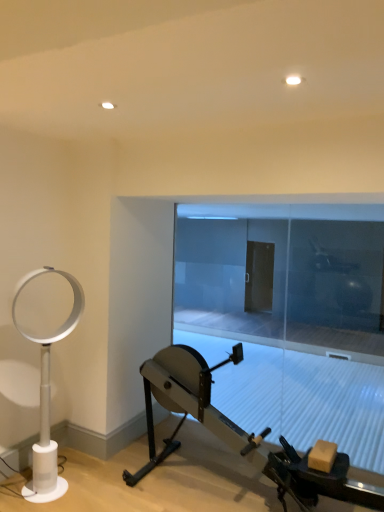
Question: Is transparent glass door at center further to camera compared to metallic silver stationary bicycle at center?

Choices:
 (A) yes
 (B) no

Answer: (A)

Question: From a real-world perspective, is transparent glass door at center below metallic silver stationary bicycle at center?

Choices:
 (A) yes
 (B) no

Answer: (B)

Question: Does transparent glass door at center appear on the right side of metallic silver stationary bicycle at center?

Choices:
 (A) no
 (B) yes

Answer: (B)

Question: Does transparent glass door at center have a lesser width compared to metallic silver stationary bicycle at center?

Choices:
 (A) yes
 (B) no

Answer: (A)

Question: Is the position of transparent glass door at center less distant than that of metallic silver stationary bicycle at center?

Choices:
 (A) yes
 (B) no

Answer: (B)

Question: Considering the positions of point (321, 333) and point (41, 352), is point (321, 333) closer or farther from the camera than point (41, 352)?

Choices:
 (A) closer
 (B) farther

Answer: (B)

Question: Is transparent glass door at center to the left or to the right of white plastic fan at left in the image?

Choices:
 (A) right
 (B) left

Answer: (A)

Question: Considering their positions, is transparent glass door at center located in front of or behind white plastic fan at left?

Choices:
 (A) behind
 (B) front

Answer: (A)

Question: Is transparent glass door at center inside the boundaries of white plastic fan at left, or outside?

Choices:
 (A) inside
 (B) outside

Answer: (B)

Question: Considering the positions of point (147, 407) and point (261, 314), is point (147, 407) closer or farther from the camera than point (261, 314)?

Choices:
 (A) farther
 (B) closer

Answer: (B)

Question: Is metallic silver stationary bicycle at center wider or thinner than transparent glass door at center?

Choices:
 (A) thin
 (B) wide

Answer: (B)

Question: Considering their positions, is metallic silver stationary bicycle at center located in front of or behind transparent glass door at center?

Choices:
 (A) behind
 (B) front

Answer: (B)

Question: From a real-world perspective, is metallic silver stationary bicycle at center physically located above or below transparent glass door at center?

Choices:
 (A) below
 (B) above

Answer: (A)

Question: Does point (64, 332) appear closer or farther from the camera than point (241, 256)?

Choices:
 (A) closer
 (B) farther

Answer: (A)

Question: In terms of height, does white plastic fan at left look taller or shorter compared to transparent glass door at center?

Choices:
 (A) short
 (B) tall

Answer: (A)